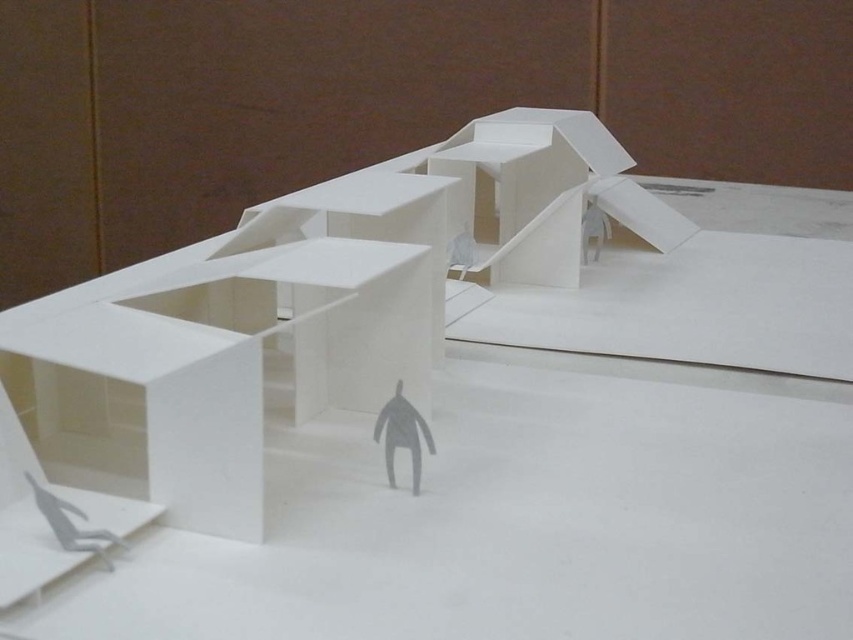
Question: Does white matte table at center appear on the left side of gray matte figure at center?

Choices:
 (A) yes
 (B) no

Answer: (B)

Question: Is white matte table at center smaller than gray matte figure at center?

Choices:
 (A) no
 (B) yes

Answer: (A)

Question: Which object is closer to the camera taking this photo?

Choices:
 (A) white matte table at center
 (B) gray matte figure at center

Answer: (A)

Question: Does white matte table at center come behind gray matte figure at center?

Choices:
 (A) no
 (B) yes

Answer: (A)